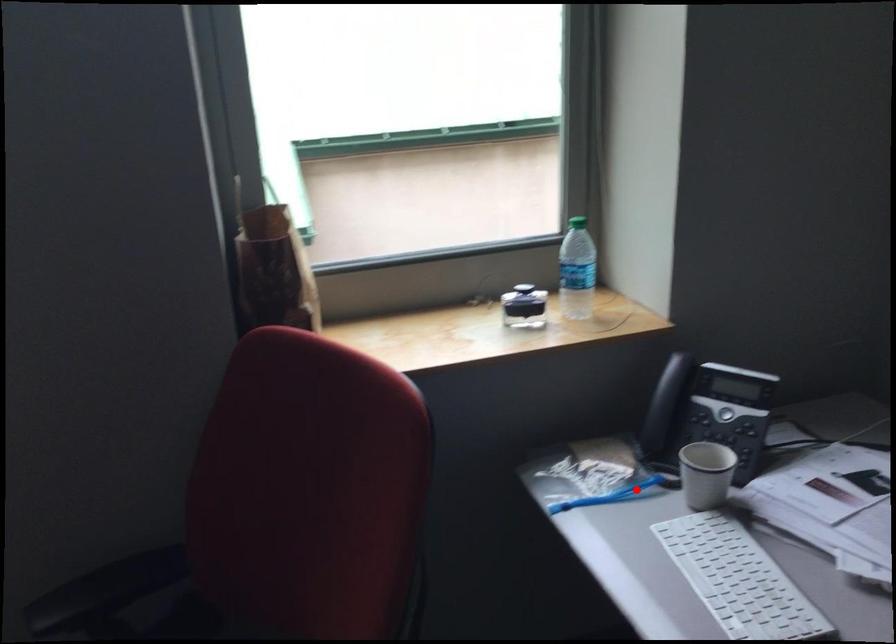
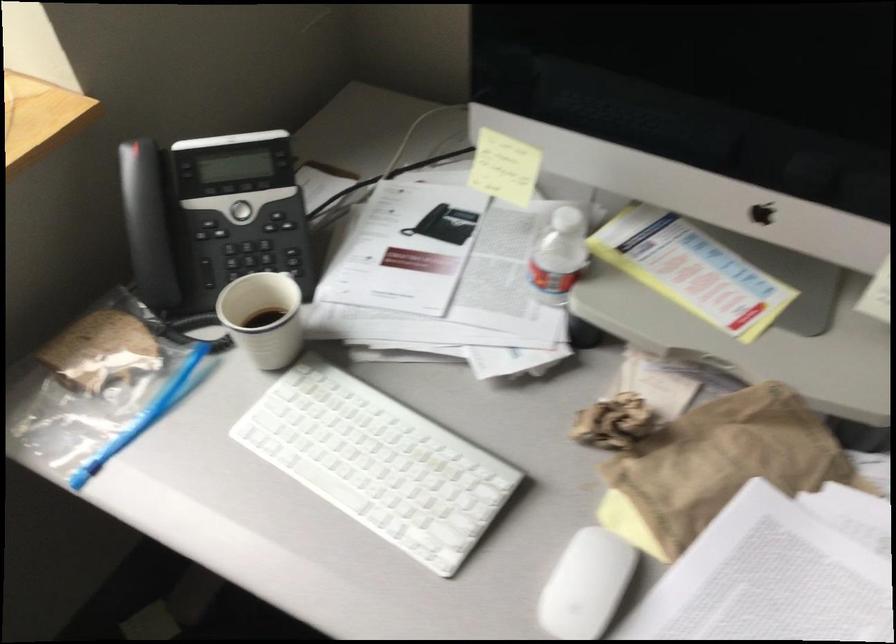
Question: I am providing you with two images of the same scene from different viewpoints. Image1 has a red point marked. In image2, the corresponding 3D location appears at what relative position? Reply with the corresponding letter.

Choices:
 (A) Closer
 (B) Farther

Answer: (A)